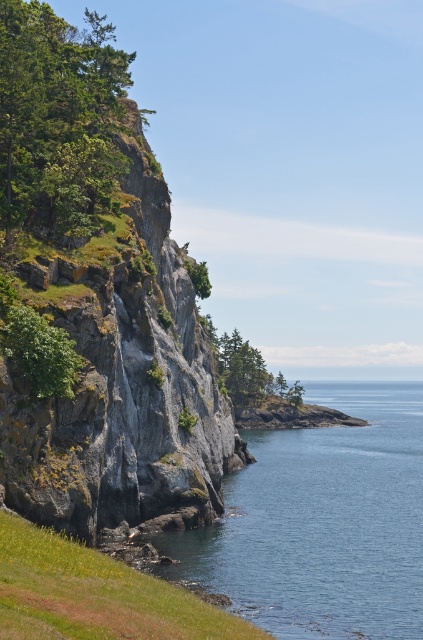
You are standing on the rugged cliff face on the left side of the image. You want to take a photo that includes both the clear blue water at center and the green leafy tree at lower left. Which object should you frame first to ensure both fit in the shot?

The clear blue water at center is bigger than the green leafy tree at lower left, so you should frame the clear blue water at center first to ensure both fit in the shot.

You are standing at the edge of the cliff looking down at the green grassy at lower left and the green leafy tree at lower left. Which one covers a larger area?

The green grassy at lower left might be wider than the green leafy tree at lower left, so it likely covers a larger area.

Based on the scene description, what does the point at coordinates (321, 522) represent?

The point at coordinates (321, 522) indicates clear blue water at center.